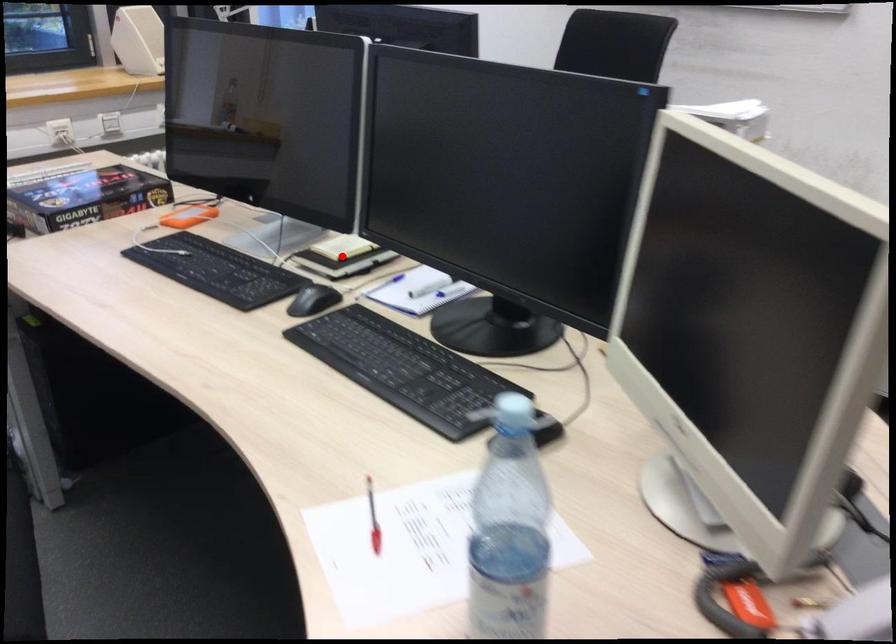
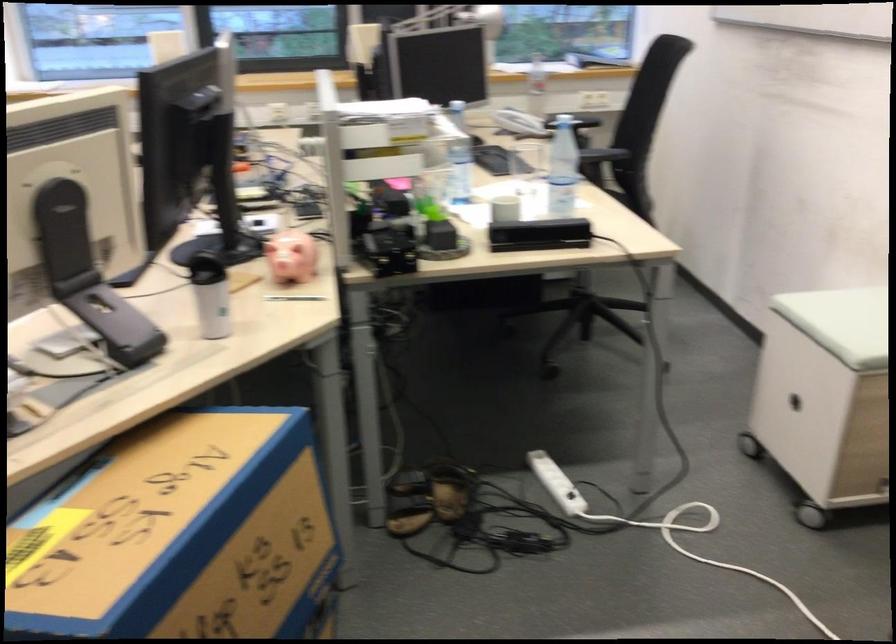
Question: I am providing you with two images of the same scene from different viewpoints. A red point is marked on the first image. Is the red point's position out of view in image 2?

Choices:
 (A) Yes
 (B) No

Answer: (A)